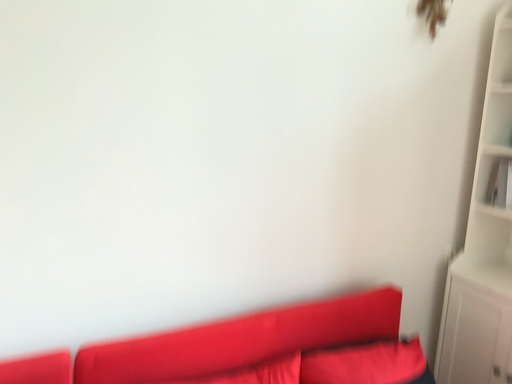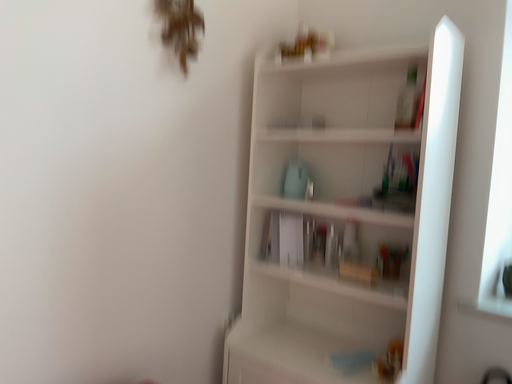
Question: How did the camera likely rotate when shooting the video?

Choices:
 (A) rotated upward
 (B) rotated downward

Answer: (A)